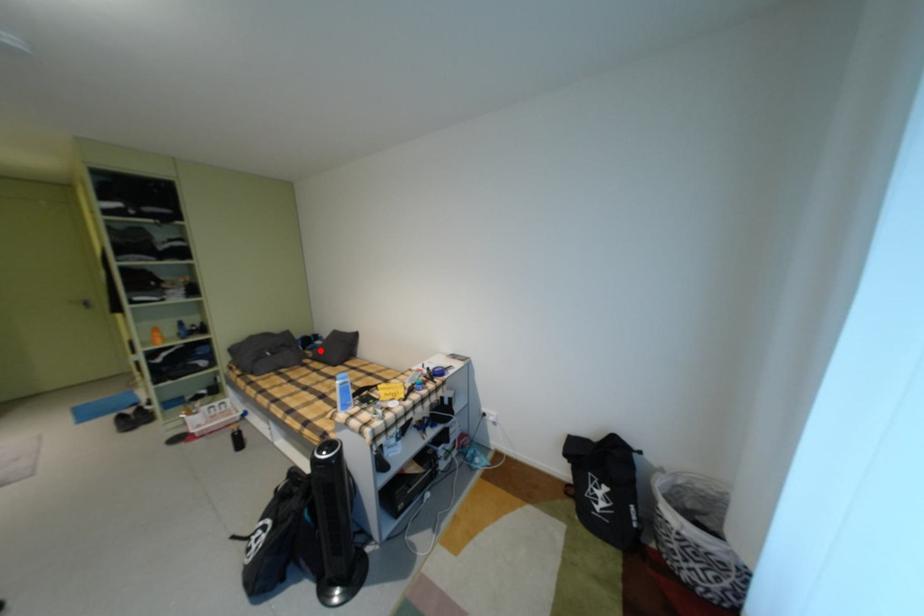
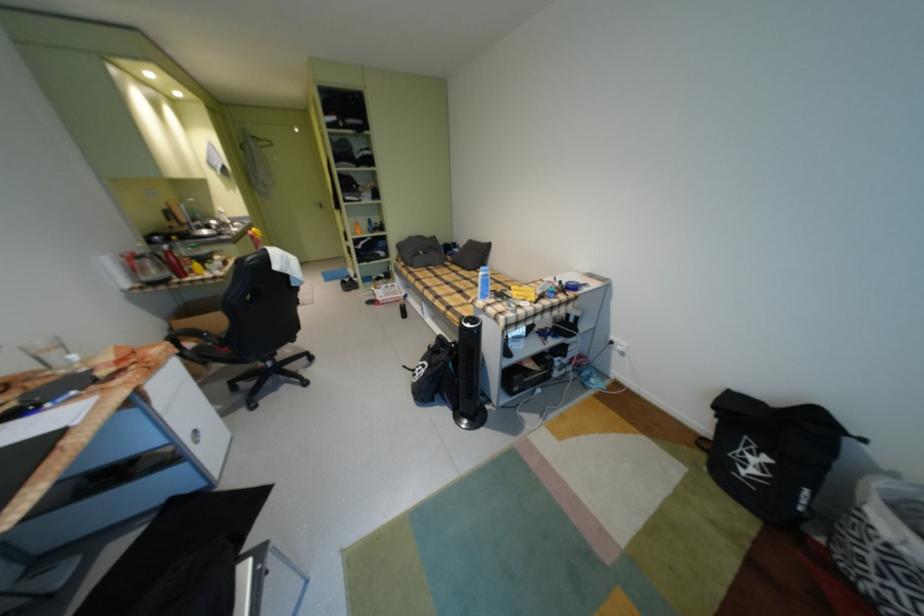
In the second image, find the point that corresponds to the highlighted location in the first image.

(459, 256)